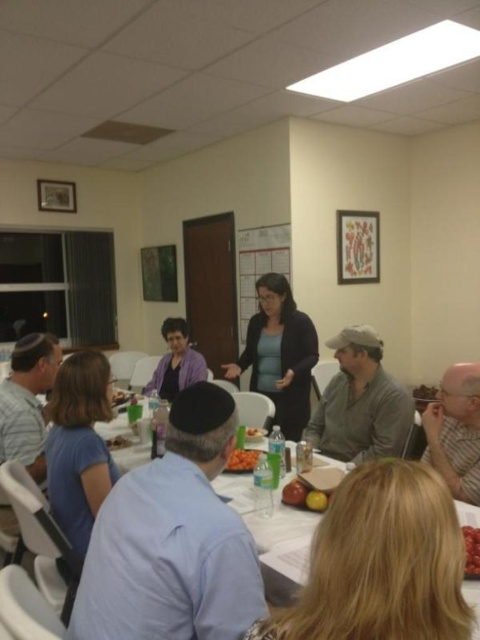
Question: Can you confirm if blue fabric shirt at lower left is positioned below gray striped shirt at lower right?

Choices:
 (A) yes
 (B) no

Answer: (B)

Question: Which object is the closest to the shiny plastic container at center?

Choices:
 (A) blue fabric shirt at lower left
 (B) dark blue sweater at center
 (C) blonde hair at lower center
 (D) gray matte shirt at lower center

Answer: (D)

Question: Which point is farther from the camera taking this photo?

Choices:
 (A) (171, 321)
 (B) (14, 396)

Answer: (A)

Question: Can you confirm if purple fabric shirt at center is wider than shiny red apple at center?

Choices:
 (A) yes
 (B) no

Answer: (A)

Question: Which point is closer to the camera?

Choices:
 (A) (379, 392)
 (B) (266, 228)
 (C) (223, 412)

Answer: (C)

Question: Can you confirm if blue fabric shirt at lower left is smaller than shiny red grapes at lower right?

Choices:
 (A) yes
 (B) no

Answer: (B)